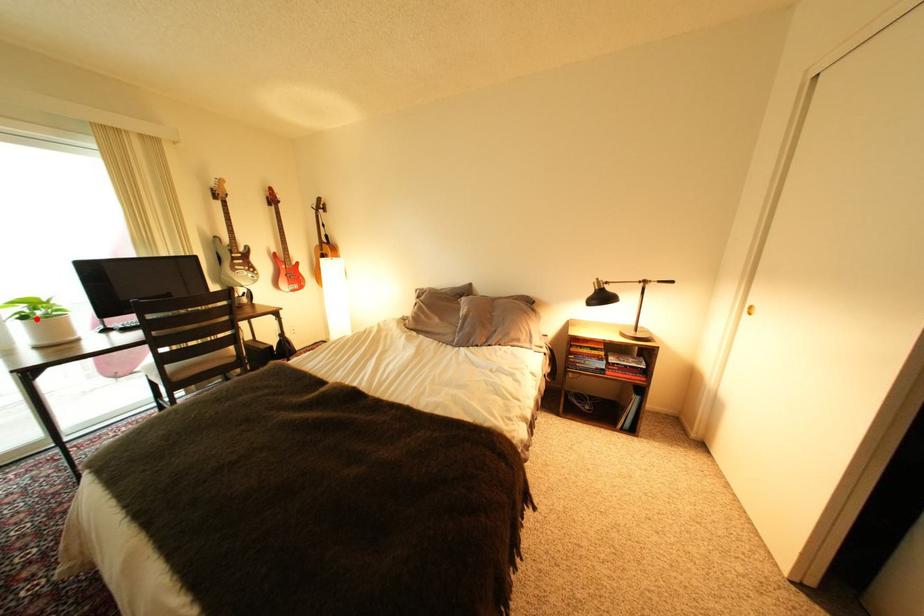
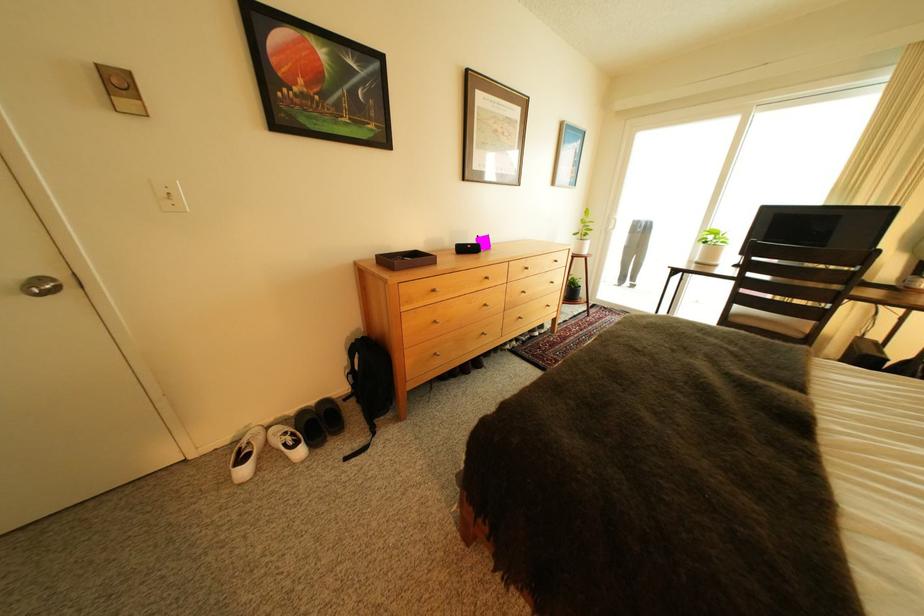
In the second image, find the point that corresponds to the highlighted location in the first image.

(718, 244)